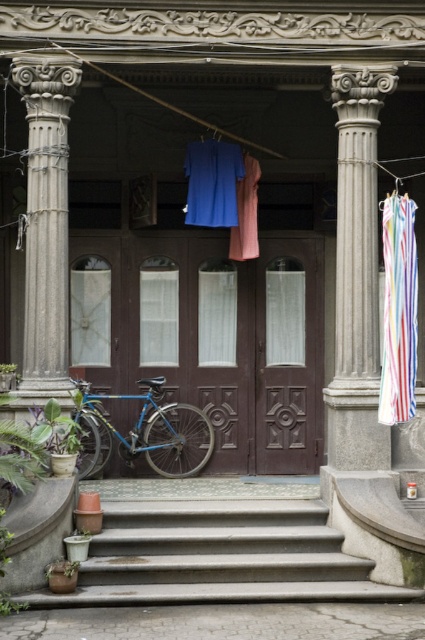
Question: Is gray stone column at left above blue metallic bicycle at lower left?

Choices:
 (A) no
 (B) yes

Answer: (B)

Question: Which point is closer to the camera?

Choices:
 (A) (342, 176)
 (B) (207, 435)
 (C) (249, 570)

Answer: (C)

Question: Can you confirm if smooth concrete stairs at center is positioned above gray stone column at right?

Choices:
 (A) yes
 (B) no

Answer: (B)

Question: Can you confirm if smooth concrete stairs at center is positioned below striped fabric at right?

Choices:
 (A) yes
 (B) no

Answer: (A)

Question: Which object is farther from the camera taking this photo?

Choices:
 (A) gray stone column at right
 (B) blue metallic bicycle at lower left
 (C) gray stone column at left

Answer: (B)

Question: Which of the following is the farthest from the observer?

Choices:
 (A) (331, 81)
 (B) (380, 406)
 (C) (36, 198)
 (D) (39, 605)

Answer: (A)